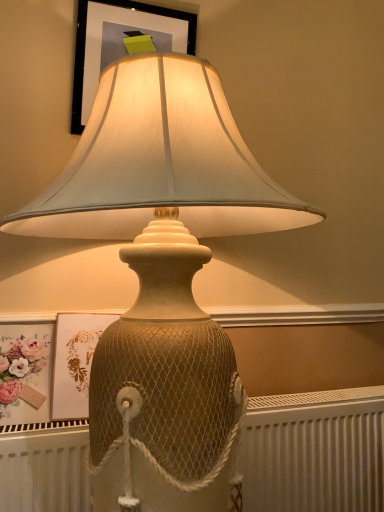
Question: In terms of height, does white textured radiator at lower center look taller or shorter compared to matte black frame at upper center, placed as the 2th picture frame when sorted from bottom to top?

Choices:
 (A) short
 (B) tall

Answer: (A)

Question: Based on their sizes in the image, would you say white textured radiator at lower center is bigger or smaller than matte black frame at upper center, placed as the 2th picture frame when sorted from bottom to top?

Choices:
 (A) small
 (B) big

Answer: (B)

Question: Estimate the real-world distances between objects in this image. Which object is closer to the matte floral print at lower left?

Choices:
 (A) matte gold picture frame at upper center, which appears as the second picture frame when viewed from the top
 (B) white textured radiator at lower center
 (C) matte black frame at upper center, placed as the 2th picture frame when sorted from bottom to top

Answer: (A)

Question: Which object is positioned closest to the matte black frame at upper center, placed as the 2th picture frame when sorted from bottom to top?

Choices:
 (A) matte gold picture frame at upper center, which appears as the second picture frame when viewed from the top
 (B) matte floral print at lower left
 (C) white textured radiator at lower center

Answer: (A)